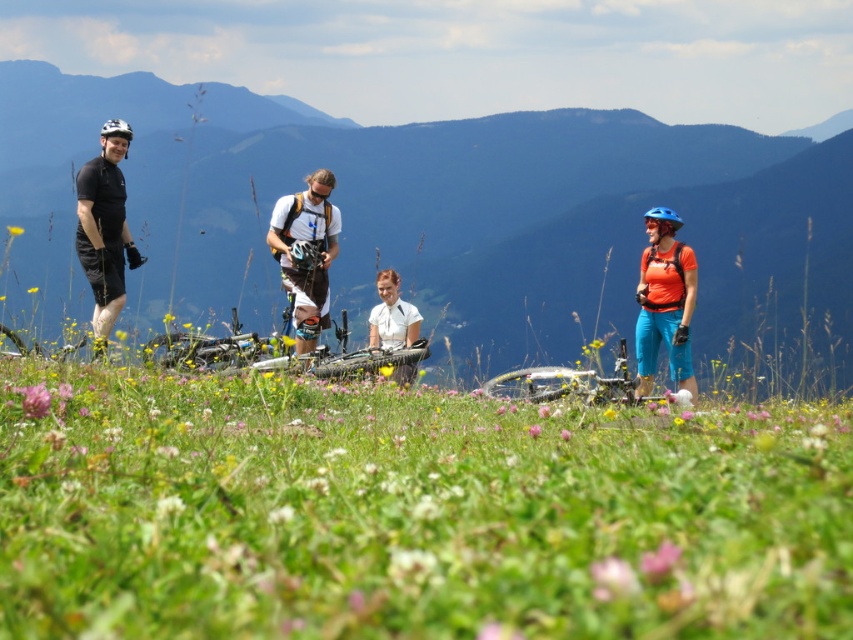
Question: Which object is farther from the camera taking this photo?

Choices:
 (A) white matte t-shirt at center
 (B) white matte shirt at center
 (C) green grassy field at center

Answer: (B)

Question: Is black matte helmet at left above white matte shirt at center?

Choices:
 (A) yes
 (B) no

Answer: (A)

Question: In this image, where is white matte t-shirt at center located relative to silver metallic bicycle at center?

Choices:
 (A) right
 (B) left

Answer: (B)

Question: Which point is farther to the camera?

Choices:
 (A) white matte shirt at center
 (B) black matte helmet at left
 (C) silver metallic bicycle at center
 (D) matte orange shirt at right

Answer: (A)

Question: Does green grassy field at center have a greater width compared to black matte helmet at left?

Choices:
 (A) no
 (B) yes

Answer: (B)

Question: Among these points, which one is nearest to the camera?

Choices:
 (A) (374, 339)
 (B) (578, 380)
 (C) (276, 243)

Answer: (B)